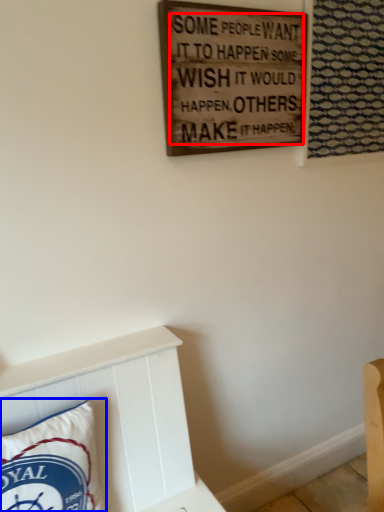
Question: Which object is closer to the camera taking this photo, writing (highlighted by a red box) or pillow (highlighted by a blue box)?

Choices:
 (A) writing
 (B) pillow

Answer: (B)